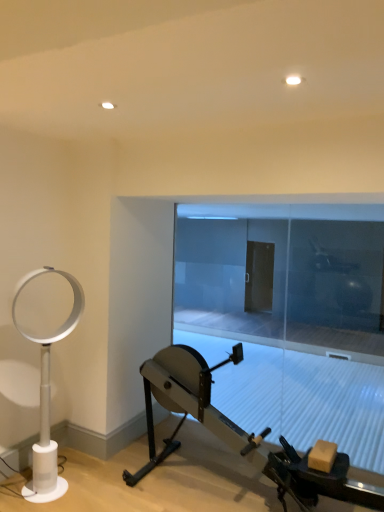
Find the location of `free region under metallic silver stationary bicycle at center (from a real-world perspective)`. free region under metallic silver stationary bicycle at center (from a real-world perspective) is located at coordinates (219, 480).